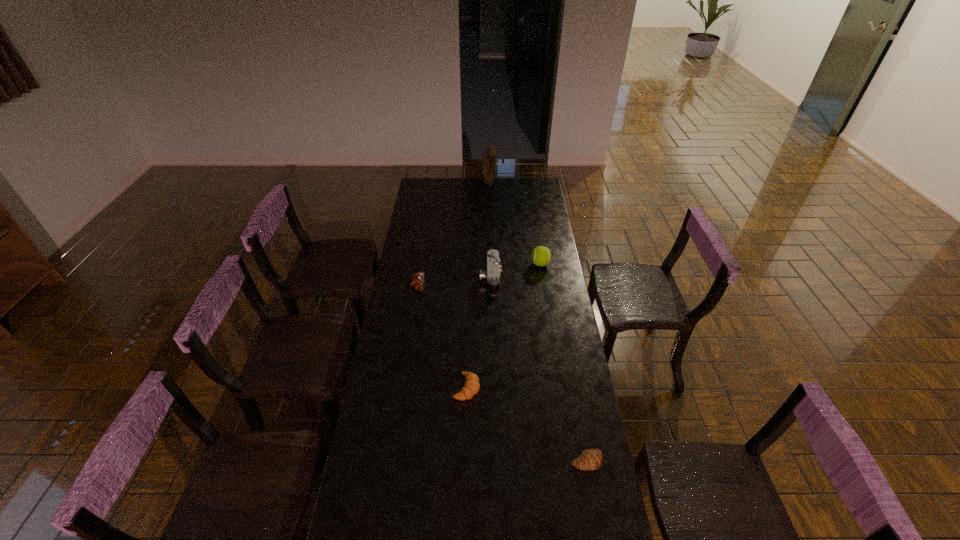
Image resolution: width=960 pixels, height=540 pixels. In order to click on tennis ball at the right edge in this screenshot , I will do `click(541, 256)`.

Where is `crescent roll that is at the right edge`? This screenshot has width=960, height=540. crescent roll that is at the right edge is located at coordinates (590, 459).

Locate an element on the screen. This screenshot has height=540, width=960. free space at the far edge is located at coordinates (444, 179).

Where is `vacant space at the left edge`? vacant space at the left edge is located at coordinates (392, 497).

Image resolution: width=960 pixels, height=540 pixels. In order to click on vacant region at the right edge of the desktop in this screenshot , I will do `click(536, 222)`.

Where is `free space at the far left corner`? This screenshot has width=960, height=540. free space at the far left corner is located at coordinates (433, 180).

You are a GUI agent. You are given a task and a screenshot of the screen. Output one action in this format:
    pyautogui.click(x=<x>, y=<y>)
    Task: Click on the free space between the nearest object and the camera
    The image size is (960, 540).
    Given the screenshot: What is the action you would take?
    pyautogui.click(x=539, y=370)

Find the location of `vacant space that is in between the nearest crescent roll and the farthest crescent roll`. vacant space that is in between the nearest crescent roll and the farthest crescent roll is located at coordinates (502, 372).

Locate an element on the screen. vacant area that lies between the tennis ball and the camera is located at coordinates (516, 272).

Locate an element on the screen. free space that is in between the leftmost object and the rightmost crescent roll is located at coordinates (502, 372).